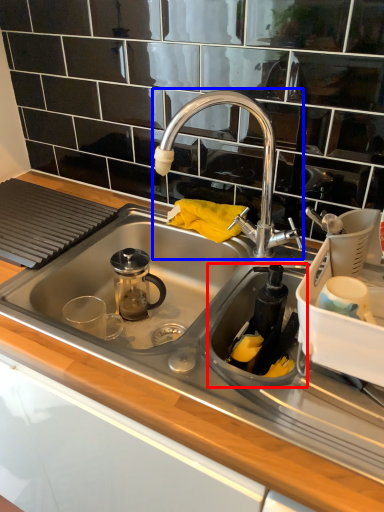
Question: Which object appears closest to the camera in this image, appliance (highlighted by a red box) or tap (highlighted by a blue box)?

Choices:
 (A) appliance
 (B) tap

Answer: (A)